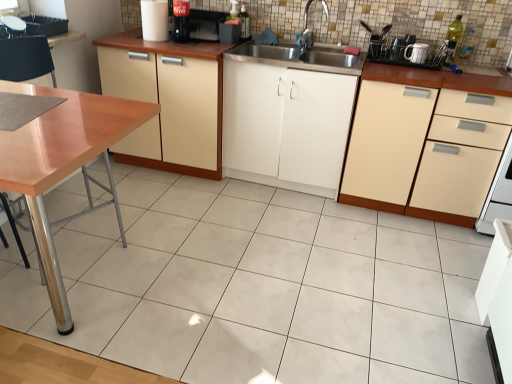
At what (x,y) coordinates should I click in order to perform the action: click on space that is in front of white ceramic mug at upper right, which appears as the first appliance when viewed from the right. Please return your answer as a coordinate pair (x, y). The height and width of the screenshot is (384, 512). Looking at the image, I should click on (421, 65).